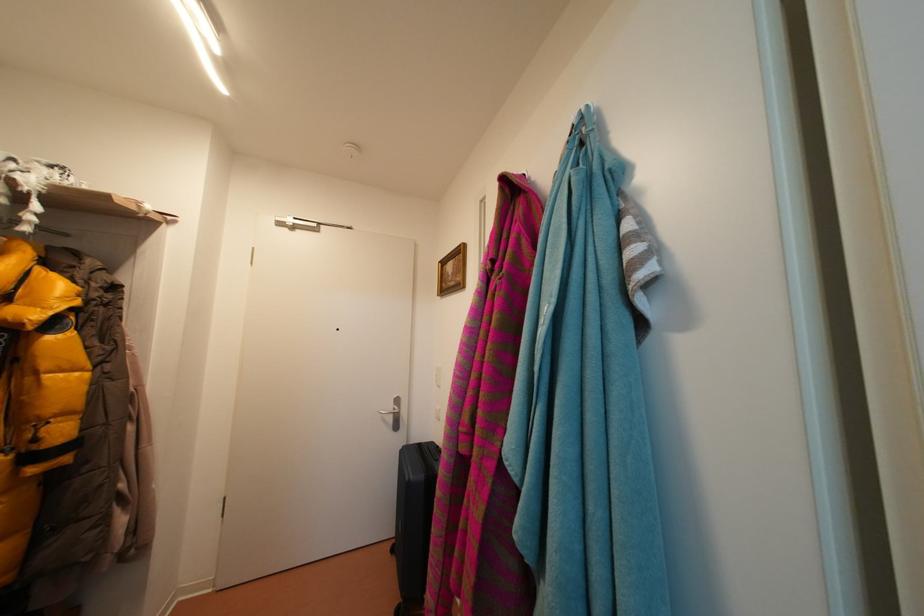
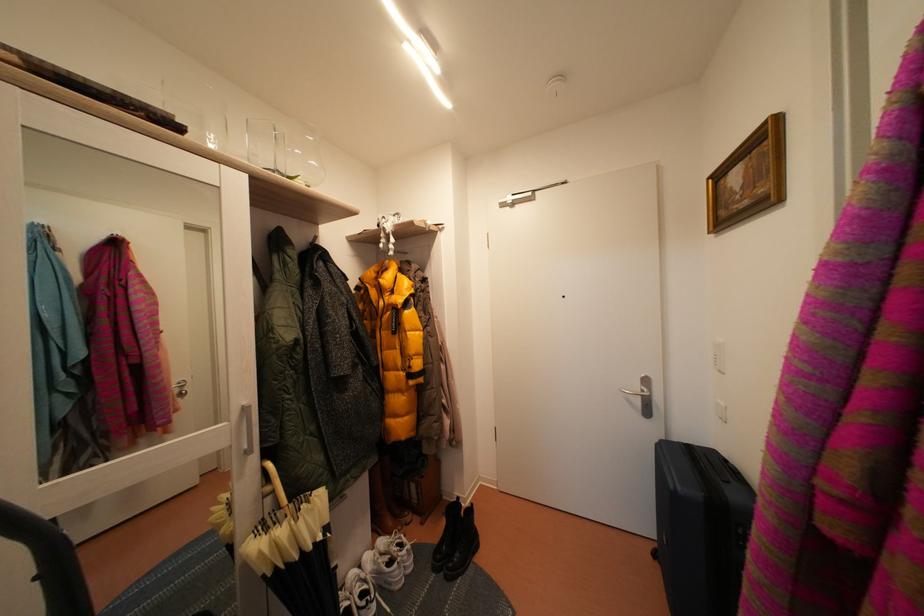
Question: Based on the continuous images, in which direction is the camera rotating? Reply with the corresponding letter.

Choices:
 (A) Left
 (B) Right
 (C) Up
 (D) Down

Answer: (A)